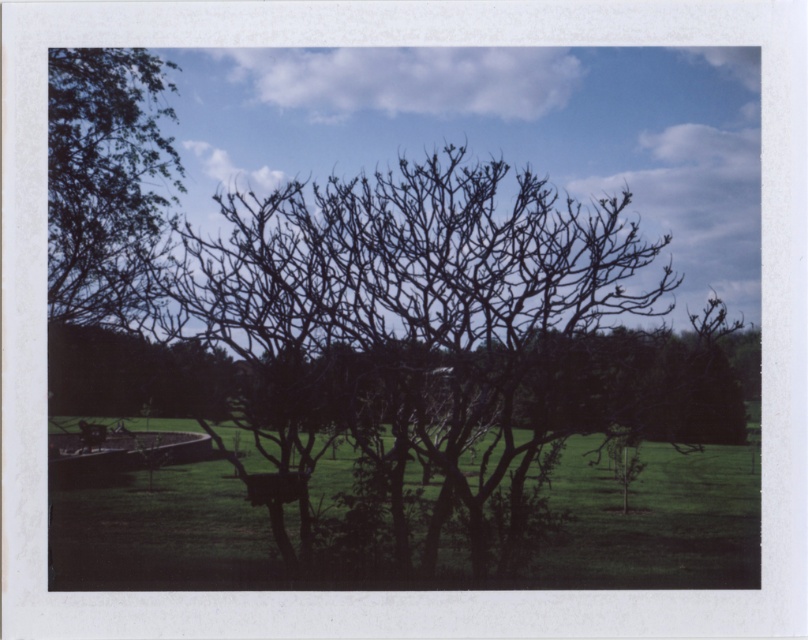
Based on the photo, does bare branches at center have a lesser width compared to green leafy tree at upper left?

In fact, bare branches at center might be wider than green leafy tree at upper left.

Measure the distance between point (394, 346) and camera.

The distance of point (394, 346) from camera is 24.27 feet.

Locate an element on the screen. This screenshot has width=808, height=640. bare branches at center is located at coordinates (421, 362).

In the scene shown: Which of these two, green grass at lower left or green leafy tree at upper left, stands shorter?

Standing shorter between the two is green grass at lower left.

Does green grass at lower left appear on the right side of green leafy tree at upper left?

Yes, green grass at lower left is to the right of green leafy tree at upper left.

Image resolution: width=808 pixels, height=640 pixels. I want to click on green grass at lower left, so click(394, 515).

Does bare branches at center appear on the right side of green grass at lower left?

Indeed, bare branches at center is positioned on the right side of green grass at lower left.

The width and height of the screenshot is (808, 640). In order to click on bare branches at center in this screenshot , I will do `click(421, 362)`.

Find the location of `bare branches at center`. bare branches at center is located at coordinates (421, 362).